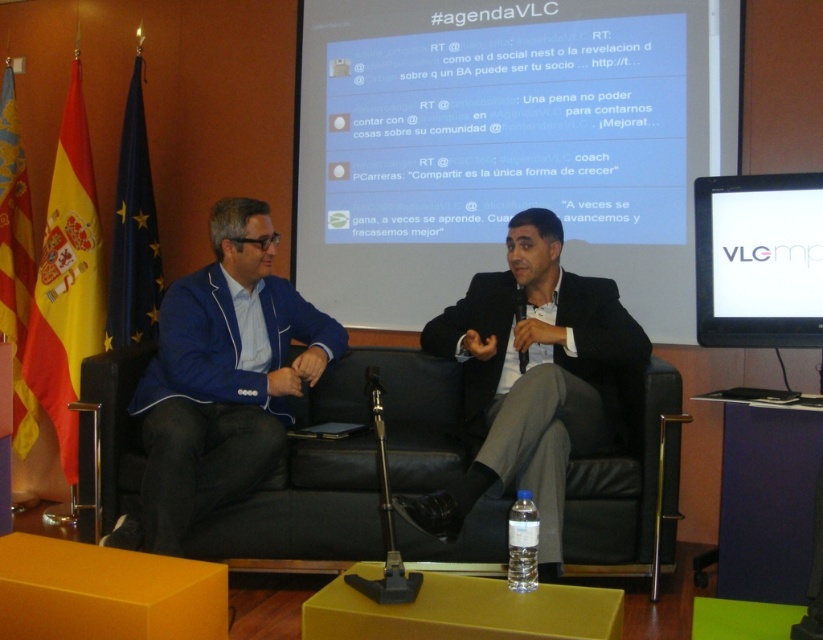
Question: Is white glossy projection screen at upper center positioned in front of dark gray suit at center?

Choices:
 (A) yes
 (B) no

Answer: (B)

Question: Based on their relative distances, which object is nearer to the black plastic microphone at center?

Choices:
 (A) dark gray suit at center
 (B) white glossy projection screen at upper center
 (C) white glossy monitor at upper right

Answer: (A)

Question: Can you confirm if white glossy monitor at upper right is positioned to the right of black plastic microphone at center?

Choices:
 (A) yes
 (B) no

Answer: (A)

Question: Which is nearer to the white glossy projection screen at upper center?

Choices:
 (A) dark gray suit at center
 (B) white glossy monitor at upper right
 (C) black leather couch at center
 (D) blue fabric jacket at center

Answer: (A)

Question: Is dark gray suit at center to the left of blue fabric jacket at center from the viewer's perspective?

Choices:
 (A) yes
 (B) no

Answer: (B)

Question: Which point is farther to the camera?

Choices:
 (A) (294, 506)
 (B) (277, 408)

Answer: (B)